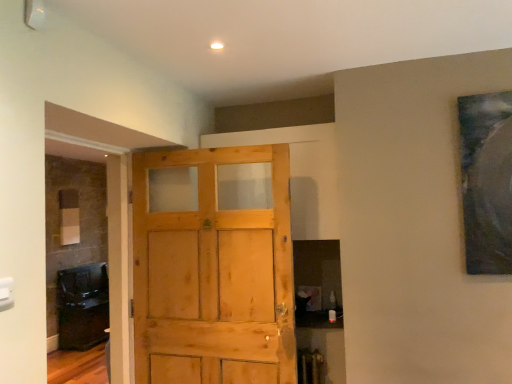
Question: Looking at their shapes, would you say light brown wood door at center is wider or thinner than dark brown wood cabinet at left?

Choices:
 (A) thin
 (B) wide

Answer: (A)

Question: From a real-world perspective, relative to dark brown wood cabinet at left, is light brown wood door at center vertically above or below?

Choices:
 (A) above
 (B) below

Answer: (A)

Question: From the image's perspective, is light brown wood door at center located above or below dark brown wood cabinet at left?

Choices:
 (A) above
 (B) below

Answer: (A)

Question: Which is correct: dark brown wood cabinet at left is inside light brown wood door at center, or outside of it?

Choices:
 (A) inside
 (B) outside

Answer: (B)

Question: From the image's perspective, is dark brown wood cabinet at left located above or below light brown wood door at center?

Choices:
 (A) below
 (B) above

Answer: (A)

Question: In the image, is dark brown wood cabinet at left on the left side or the right side of light brown wood door at center?

Choices:
 (A) right
 (B) left

Answer: (B)

Question: In the image, is dark brown wood cabinet at left positioned in front of or behind light brown wood door at center?

Choices:
 (A) behind
 (B) front

Answer: (A)